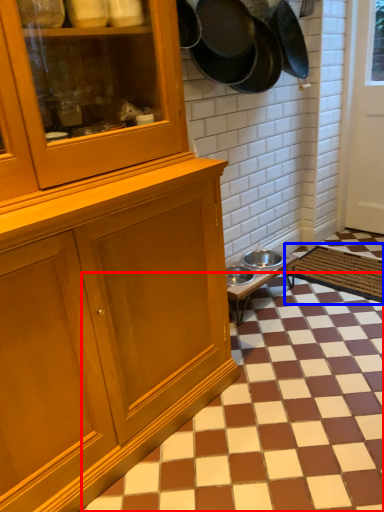
Question: Which object is closer to the camera taking this photo, tile (highlighted by a red box) or doormat (highlighted by a blue box)?

Choices:
 (A) tile
 (B) doormat

Answer: (A)